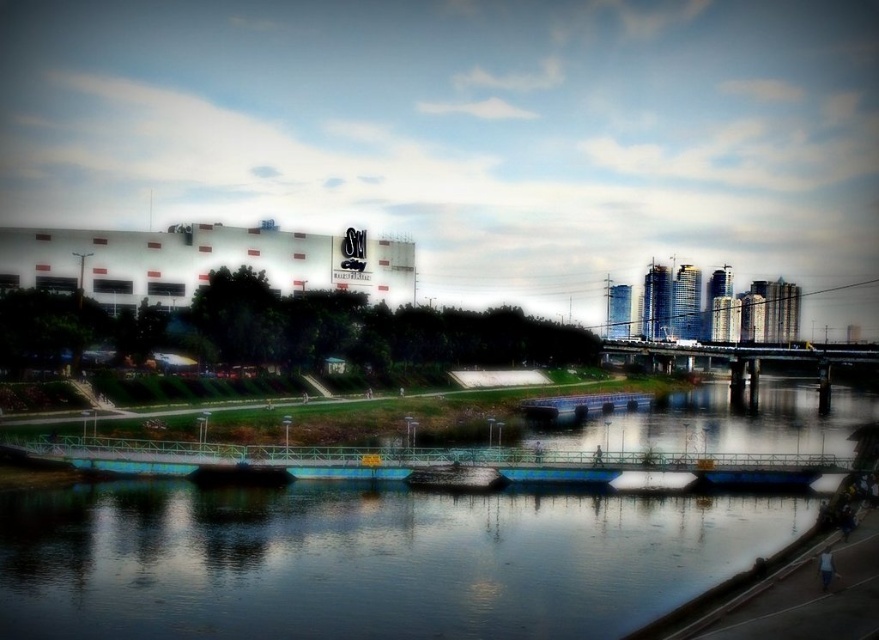
Question: Which point is farther from the camera taking this photo?

Choices:
 (A) (140, 522)
 (B) (449, 465)

Answer: (B)

Question: Is blue smooth water at center above shiny dark wood boat at center?

Choices:
 (A) no
 (B) yes

Answer: (A)

Question: Considering the relative positions of blue smooth water at center and shiny dark wood boat at center in the image provided, where is blue smooth water at center located with respect to shiny dark wood boat at center?

Choices:
 (A) below
 (B) above

Answer: (A)

Question: Among these points, which one is nearest to the camera?

Choices:
 (A) (688, 593)
 (B) (492, 470)

Answer: (A)

Question: Can you confirm if blue smooth water at center is positioned above shiny dark wood boat at center?

Choices:
 (A) yes
 (B) no

Answer: (B)

Question: Which object appears closest to the camera in this image?

Choices:
 (A) blue smooth water at center
 (B) shiny dark wood boat at center

Answer: (A)